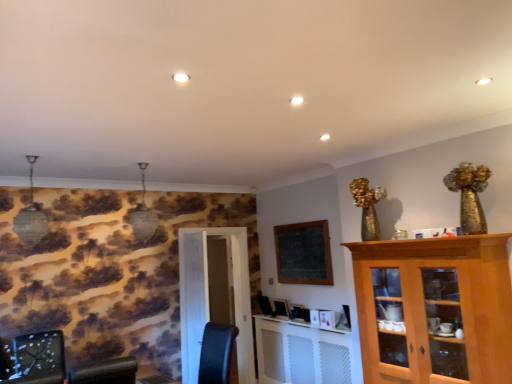
Question: From the image's perspective, is white glossy door at center located beneath wooden table at lower center?

Choices:
 (A) no
 (B) yes

Answer: (B)

Question: Considering the relative sizes of white glossy door at center and wooden table at lower center in the image provided, is white glossy door at center bigger than wooden table at lower center?

Choices:
 (A) yes
 (B) no

Answer: (A)

Question: Is white glossy door at center not near wooden table at lower center?

Choices:
 (A) yes
 (B) no

Answer: (A)

Question: Is white glossy door at center oriented towards wooden table at lower center?

Choices:
 (A) yes
 (B) no

Answer: (B)

Question: Is wooden table at lower center at the back of white glossy door at center?

Choices:
 (A) yes
 (B) no

Answer: (B)

Question: Is wooden table at lower center a part of white glossy door at center?

Choices:
 (A) no
 (B) yes

Answer: (A)

Question: Considering the relative sizes of wooden table at lower center and wooden bulletin board at upper center in the image provided, is wooden table at lower center bigger than wooden bulletin board at upper center?

Choices:
 (A) no
 (B) yes

Answer: (A)

Question: From the image's perspective, is wooden table at lower center on top of wooden bulletin board at upper center?

Choices:
 (A) yes
 (B) no

Answer: (B)

Question: Is wooden table at lower center to the left of wooden bulletin board at upper center from the viewer's perspective?

Choices:
 (A) yes
 (B) no

Answer: (A)

Question: Is wooden table at lower center to the right of wooden bulletin board at upper center from the viewer's perspective?

Choices:
 (A) no
 (B) yes

Answer: (A)

Question: Does wooden table at lower center have a greater width compared to wooden bulletin board at upper center?

Choices:
 (A) yes
 (B) no

Answer: (A)

Question: Can you confirm if wooden table at lower center is smaller than wooden bulletin board at upper center?

Choices:
 (A) yes
 (B) no

Answer: (A)

Question: From the image's perspective, is wooden table at lower center over light brown wooden cabinet at right?

Choices:
 (A) no
 (B) yes

Answer: (A)